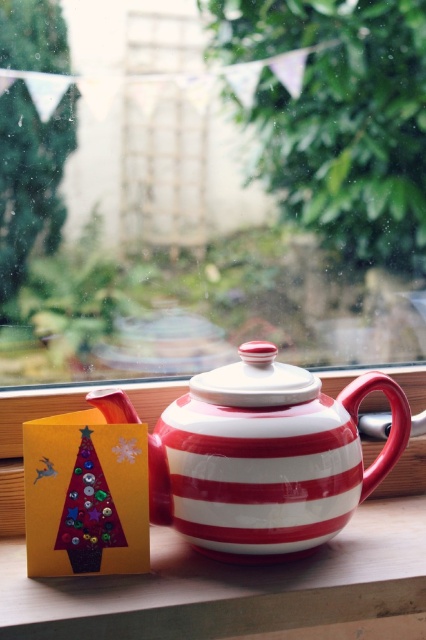
Question: Is transparent glass window at center positioned in front of red and white striped teapot at center?

Choices:
 (A) no
 (B) yes

Answer: (A)

Question: Does red and white striped teapot at center come in front of wooden ledge at lower left?

Choices:
 (A) no
 (B) yes

Answer: (A)

Question: Is red and white striped teapot at center positioned in front of wooden ledge at lower left?

Choices:
 (A) no
 (B) yes

Answer: (A)

Question: Which point is farther to the camera?

Choices:
 (A) (192, 518)
 (B) (100, 365)
 (C) (78, 602)

Answer: (B)

Question: Which point is closer to the camera?

Choices:
 (A) click(x=215, y=394)
 (B) click(x=19, y=600)

Answer: (B)

Question: Which object appears closest to the camera in this image?

Choices:
 (A) wooden ledge at lower left
 (B) transparent glass window at center

Answer: (A)